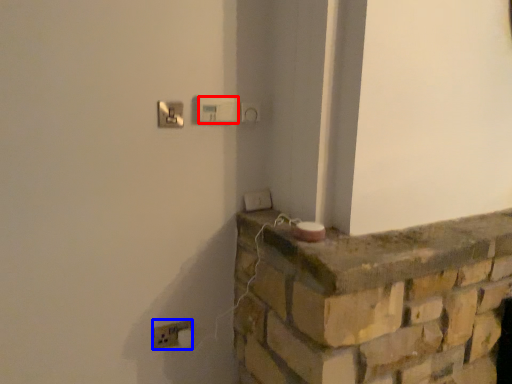
Question: Which object appears farthest to the camera in this image, light switch (highlighted by a red box) or electric outlet (highlighted by a blue box)?

Choices:
 (A) light switch
 (B) electric outlet

Answer: (B)